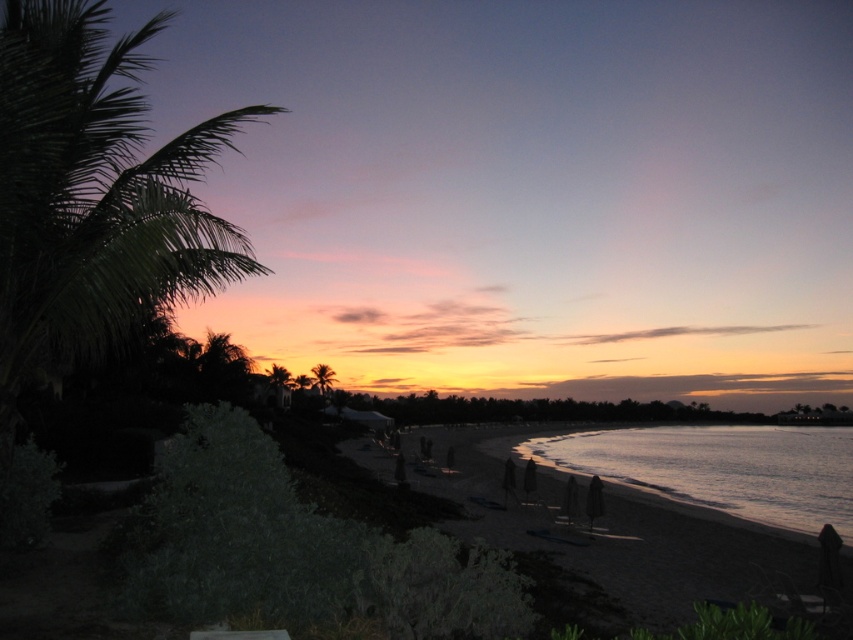
Can you confirm if green leafy palm tree at left is shorter than silvery reflective water at lower right?

No.

Where is `green leafy palm tree at left`? The width and height of the screenshot is (853, 640). green leafy palm tree at left is located at coordinates (96, 192).

Between silvery reflective water at lower right and green leafy palm tree at center, which one appears on the left side from the viewer's perspective?

From the viewer's perspective, green leafy palm tree at center appears more on the left side.

Is point (758, 518) positioned behind point (316, 385)?

No.

Does point (547, 458) come in front of point (323, 381)?

Yes.

The image size is (853, 640). What are the coordinates of `silvery reflective water at lower right` in the screenshot? It's located at (722, 468).

Which of these two, green leafy palm tree at left or green leafy palm tree at center, stands shorter?

green leafy palm tree at center

Describe the element at coordinates (96, 192) in the screenshot. I see `green leafy palm tree at left` at that location.

Find the location of `green leafy palm tree at left`. green leafy palm tree at left is located at coordinates (96, 192).